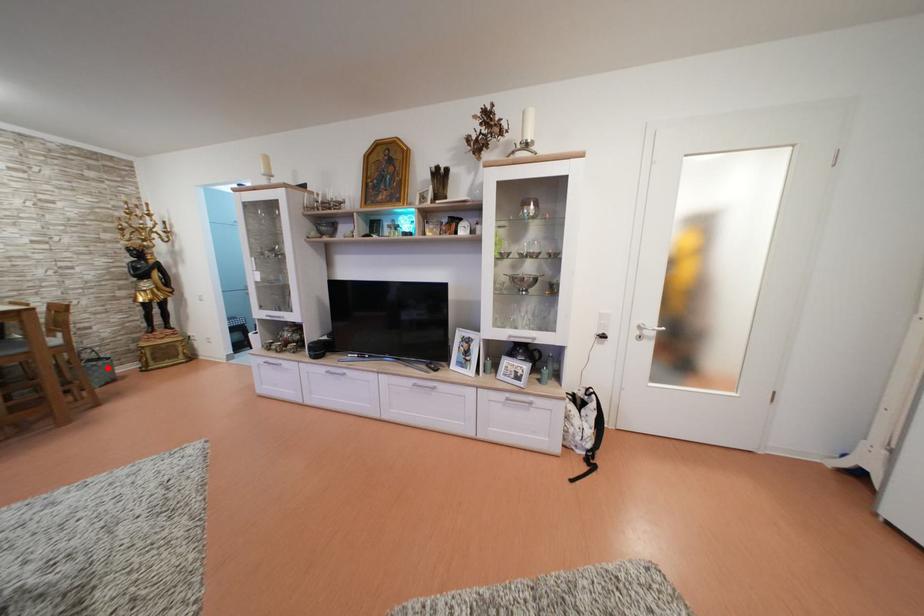
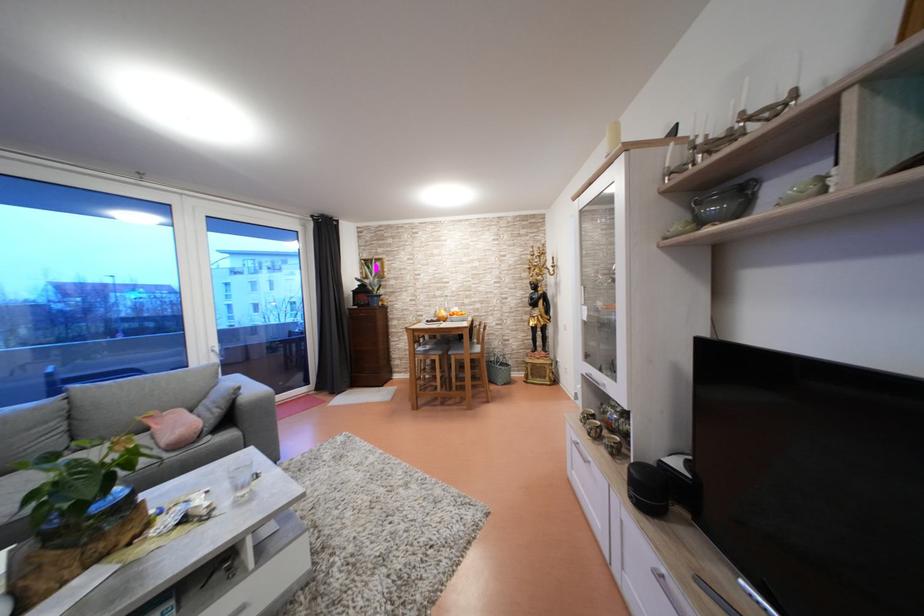
The point at the highlighted location is marked in the first image. Where is the corresponding point in the second image?

(511, 373)